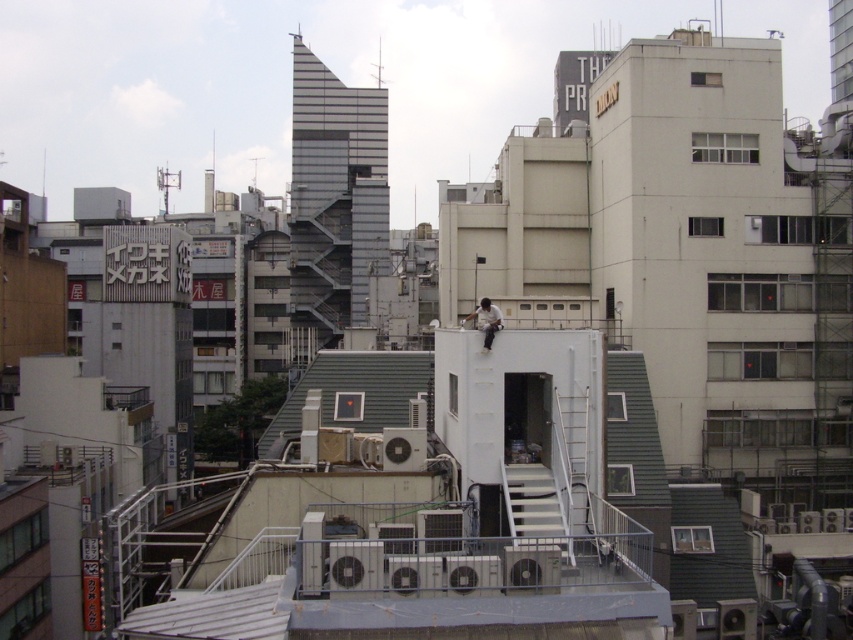
You are a city planner analyzing rooftop spaces. You notice the green matte roof at center and the white matte shirt at center in the image. Which object occupies more area in the scene?

The green matte roof at center is larger in size than the white matte shirt at center, so it occupies more area in the scene.

You are standing on the rooftop and want to move from the green matte roof at center to the white matte shirt at center. Which direction should you move in?

You should move to the right to reach the white matte shirt at center from the green matte roof at center since the green matte roof at center is to the left of the white matte shirt at center.

You are standing on a balcony 20 meters away from the green matte roof at center. Can you safely walk towards it without any obstacles?

The green matte roof at center is 31.34 meters away from the viewer. Since you are only 20 meters away, you are closer and can safely walk towards it as there are no obstacles mentioned in the scene description.